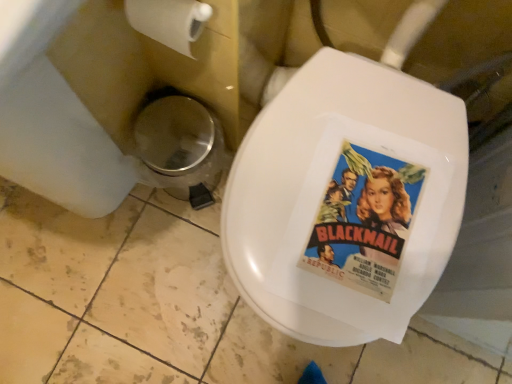
The image size is (512, 384). Describe the element at coordinates (169, 21) in the screenshot. I see `white matte toilet paper at upper left` at that location.

Identify the location of metallic silver trash can at lower left. This screenshot has width=512, height=384. (180, 148).

Where is `vintage paper movie poster at center`? Image resolution: width=512 pixels, height=384 pixels. vintage paper movie poster at center is located at coordinates (364, 221).

From their relative heights in the image, would you say metallic silver trash can at lower left is taller or shorter than white matte toilet paper at upper left?

Clearly, metallic silver trash can at lower left is taller compared to white matte toilet paper at upper left.

From a real-world perspective, does metallic silver trash can at lower left sit lower than white matte toilet paper at upper left?

Yes, from a real-world perspective, metallic silver trash can at lower left is beneath white matte toilet paper at upper left.

Does point (148, 125) lie in front of point (179, 44)?

No, (148, 125) is further to viewer.

Identify the location of toilet paper on the right of metallic silver trash can at lower left. The image size is (512, 384). (169, 21).

Considering the relative sizes of vintage paper movie poster at center and white matte toilet paper at upper left in the image provided, is vintage paper movie poster at center taller than white matte toilet paper at upper left?

In fact, vintage paper movie poster at center may be shorter than white matte toilet paper at upper left.

What's the angular difference between vintage paper movie poster at center and white matte toilet paper at upper left's facing directions?

→ The facing directions of vintage paper movie poster at center and white matte toilet paper at upper left are 4.77 degrees apart.

Identify the location of toilet paper in front of the vintage paper movie poster at center. The width and height of the screenshot is (512, 384). (169, 21).

Which of these two, metallic silver trash can at lower left or vintage paper movie poster at center, is bigger?

metallic silver trash can at lower left is bigger.

Who is taller, metallic silver trash can at lower left or vintage paper movie poster at center?

Standing taller between the two is metallic silver trash can at lower left.

Is point (169, 173) closer or farther from the camera than point (343, 176)?

Point (169, 173) is positioned farther from the camera compared to point (343, 176).

In terms of height, does vintage paper movie poster at center look taller or shorter compared to metallic silver trash can at lower left?

In the image, vintage paper movie poster at center appears to be shorter than metallic silver trash can at lower left.

Can you confirm if vintage paper movie poster at center is smaller than metallic silver trash can at lower left?

Indeed, vintage paper movie poster at center has a smaller size compared to metallic silver trash can at lower left.

Can we say vintage paper movie poster at center lies outside metallic silver trash can at lower left?

vintage paper movie poster at center lies outside metallic silver trash can at lower left's area.

How far apart are white matte toilet paper at upper left and metallic silver trash can at lower left?

white matte toilet paper at upper left and metallic silver trash can at lower left are 12.67 inches apart.

Which is further, (164, 41) or (174, 144)?

The point (174, 144) is farther.

How many degrees apart are the facing directions of white matte toilet paper at upper left and metallic silver trash can at lower left?

The angle between the facing direction of white matte toilet paper at upper left and the facing direction of metallic silver trash can at lower left is 1.37 degrees.

Could you tell me if white matte toilet paper at upper left is facing metallic silver trash can at lower left?

No, white matte toilet paper at upper left is not facing towards metallic silver trash can at lower left.

Does white matte toilet paper at upper left contain vintage paper movie poster at center?

Definitely not — vintage paper movie poster at center is not inside white matte toilet paper at upper left.

Who is shorter, white matte toilet paper at upper left or vintage paper movie poster at center?

With less height is vintage paper movie poster at center.

Is point (196, 27) closer to viewer compared to point (341, 195)?

Yes, point (196, 27) is in front of point (341, 195).

Could you tell me if white matte toilet paper at upper left is turned towards vintage paper movie poster at center?

No, white matte toilet paper at upper left is not aimed at vintage paper movie poster at center.

The image size is (512, 384). In order to click on potty that appears below the white matte toilet paper at upper left (from a real-world perspective) in this screenshot , I will do click(x=180, y=148).

I want to click on toilet paper that is above the vintage paper movie poster at center (from a real-world perspective), so click(169, 21).

From the picture: Based on their spatial positions, is white matte toilet paper at upper left or vintage paper movie poster at center closer to metallic silver trash can at lower left?

white matte toilet paper at upper left lies closer to metallic silver trash can at lower left than the other object.

Looking at the image, which one is located closer to vintage paper movie poster at center, white matte toilet paper at upper left or metallic silver trash can at lower left?

white matte toilet paper at upper left lies closer to vintage paper movie poster at center than the other object.

From the image, which object appears to be farther from white matte toilet paper at upper left, metallic silver trash can at lower left or vintage paper movie poster at center?

vintage paper movie poster at center.

When comparing their distances from vintage paper movie poster at center, does metallic silver trash can at lower left or white matte toilet paper at upper left seem further?

Among the two, metallic silver trash can at lower left is located further to vintage paper movie poster at center.

From the image, which object appears to be nearer to white matte toilet paper at upper left, vintage paper movie poster at center or metallic silver trash can at lower left?

metallic silver trash can at lower left is positioned closer to the anchor white matte toilet paper at upper left.

From the picture: Estimate the real-world distances between objects in this image. Which object is further from metallic silver trash can at lower left, vintage paper movie poster at center or white matte toilet paper at upper left?

Among the two, vintage paper movie poster at center is located further to metallic silver trash can at lower left.

This screenshot has width=512, height=384. Find the location of `toilet paper situated between metallic silver trash can at lower left and vintage paper movie poster at center from left to right`. toilet paper situated between metallic silver trash can at lower left and vintage paper movie poster at center from left to right is located at coordinates (169, 21).